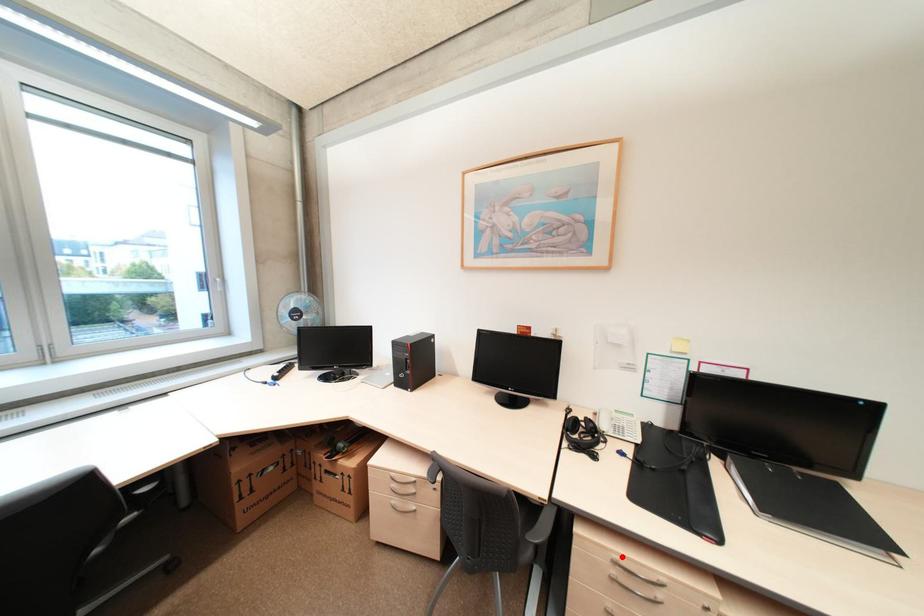
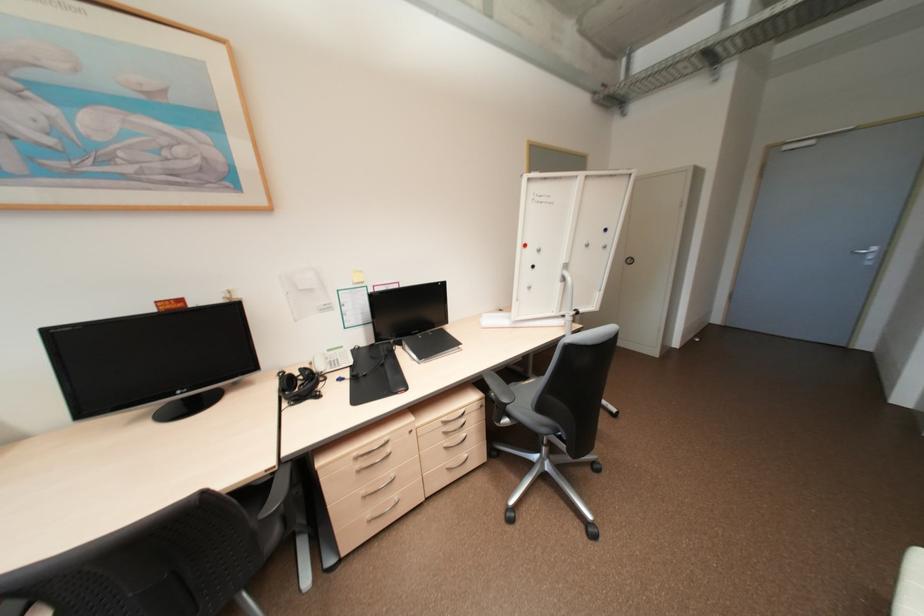
Where in the second image is the point corresponding to the highlighted location from the first image?

(360, 454)